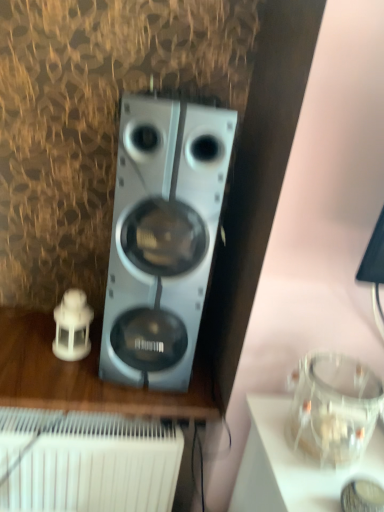
Measure the distance between satin silver speaker at center and camera.

They are 95.34 centimeters apart.

You are a GUI agent. You are given a task and a screenshot of the screen. Output one action in this format:
    pyautogui.click(x=<x>, y=<y>)
    Task: Click on the white plastic speaker at left
    
    Given the screenshot: What is the action you would take?
    pyautogui.click(x=85, y=376)

In order to click on satin silver speaker at center in this screenshot , I will do click(162, 237).

Considering the relative sizes of white plastic speaker at left and satin silver speaker at center in the image provided, is white plastic speaker at left wider than satin silver speaker at center?

Yes, white plastic speaker at left is wider than satin silver speaker at center.

Is white plastic speaker at left closer to the viewer compared to satin silver speaker at center?

No, white plastic speaker at left is further to the viewer.

From the image's perspective, which is below, white plastic speaker at left or satin silver speaker at center?

From the image's view, white plastic speaker at left is below.

Considering the relative sizes of white plastic speaker at left and satin silver speaker at center in the image provided, is white plastic speaker at left shorter than satin silver speaker at center?

Correct, white plastic speaker at left is not as tall as satin silver speaker at center.

I want to click on radiator that appears on the left of satin silver speaker at center, so click(x=86, y=462).

Is white plastic radiator at lower left positioned far away from satin silver speaker at center?

That's not correct — white plastic radiator at lower left is a little close to satin silver speaker at center.

From the image's perspective, does white plastic radiator at lower left appear higher than satin silver speaker at center?

No, from the image's perspective, white plastic radiator at lower left is not above satin silver speaker at center.

The image size is (384, 512). What are the coordinates of `radiator below the white plastic speaker at left (from a real-world perspective)` in the screenshot? It's located at (86, 462).

From a real-world perspective, is white plastic speaker at left physically located above or below white plastic radiator at lower left?

white plastic speaker at left is situated higher than white plastic radiator at lower left in the real world.

Does white plastic speaker at left have a larger size compared to white plastic radiator at lower left?

No, white plastic speaker at left is not bigger than white plastic radiator at lower left.

Is white plastic speaker at left closer to camera compared to white plastic radiator at lower left?

No, white plastic speaker at left is further to the viewer.

Is white plastic radiator at lower left touching white plastic speaker at left?

No, white plastic radiator at lower left is not making contact with white plastic speaker at left.

From their relative heights in the image, would you say white plastic radiator at lower left is taller or shorter than white plastic speaker at left?

Clearly, white plastic radiator at lower left is taller compared to white plastic speaker at left.

Is white plastic radiator at lower left wider than white plastic speaker at left?

Yes.

Is satin silver speaker at center taller than white plastic speaker at left?

Yes.

The width and height of the screenshot is (384, 512). I want to click on furniture below the satin silver speaker at center (from the image's perspective), so click(85, 376).

Can white plastic speaker at left be found inside satin silver speaker at center?

No, white plastic speaker at left is located outside of satin silver speaker at center.

Is point (194, 230) behind point (62, 399)?

That is False.

Which of these two, satin silver speaker at center or white plastic radiator at lower left, is bigger?

white plastic radiator at lower left is bigger.

Is satin silver speaker at center directly adjacent to white plastic radiator at lower left?

They are not placed beside each other.

From a real-world perspective, is satin silver speaker at center above or below white plastic radiator at lower left?

Clearly, from a real-world perspective, satin silver speaker at center is above white plastic radiator at lower left.

Relative to white plastic radiator at lower left, is satin silver speaker at center in front or behind?

satin silver speaker at center is positioned closer to the viewer than white plastic radiator at lower left.

At what (x,y) coordinates should I click in order to perform the action: click on furniture lying below the satin silver speaker at center (from the image's perspective). Please return your answer as a coordinate pair (x, y). Looking at the image, I should click on (85, 376).

In order to click on radiator beneath the satin silver speaker at center (from a real-world perspective) in this screenshot , I will do click(86, 462).

Which object lies nearer to the anchor point white plastic speaker at left, white plastic radiator at lower left or satin silver speaker at center?

white plastic radiator at lower left.

Considering their positions, is satin silver speaker at center positioned further to white plastic speaker at left than white plastic radiator at lower left?

Based on the image, satin silver speaker at center appears to be further to white plastic speaker at left.

Based on their spatial positions, is white plastic radiator at lower left or white plastic speaker at left closer to satin silver speaker at center?

Based on the image, white plastic speaker at left appears to be nearer to satin silver speaker at center.

Based on their spatial positions, is satin silver speaker at center or white plastic speaker at left closer to white plastic radiator at lower left?

white plastic speaker at left.

Based on their spatial positions, is white plastic speaker at left or white plastic radiator at lower left further from satin silver speaker at center?

white plastic radiator at lower left is further to satin silver speaker at center.

Estimate the real-world distances between objects in this image. Which object is closer to white plastic radiator at lower left, white plastic speaker at left or satin silver speaker at center?

Based on the image, white plastic speaker at left appears to be nearer to white plastic radiator at lower left.

Where is `furniture between satin silver speaker at center and white plastic radiator at lower left in the vertical direction`? This screenshot has width=384, height=512. furniture between satin silver speaker at center and white plastic radiator at lower left in the vertical direction is located at coordinates (85, 376).